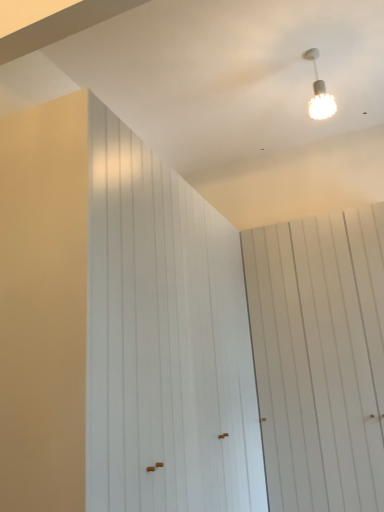
Find the location of a particular element. This screenshot has width=384, height=512. white wood barn door at left, the first barn door viewed from the left is located at coordinates (164, 340).

At what (x,y) coordinates should I click in order to perform the action: click on white textured lampshade at upper right. Please return your answer as a coordinate pair (x, y). Looking at the image, I should click on (319, 92).

Find the location of `white wood barn door at upper right, the 2th barn door positioned from the left`. white wood barn door at upper right, the 2th barn door positioned from the left is located at coordinates (320, 358).

Measure the distance between point (252, 268) and camera.

The distance of point (252, 268) from camera is 3.04 meters.

What are the coordinates of `white wood barn door at left, the first barn door viewed from the left` in the screenshot? It's located at (164, 340).

Is white wood barn door at upper right, the 1th barn door when ordered from right to left, surrounded by white textured lampshade at upper right?

No.

Can you confirm if white textured lampshade at upper right is taller than white wood barn door at upper right, the 2th barn door positioned from the left?

No, white textured lampshade at upper right is not taller than white wood barn door at upper right, the 2th barn door positioned from the left.

Considering the sizes of white textured lampshade at upper right and white wood barn door at upper right, the 1th barn door when ordered from right to left, in the image, is white textured lampshade at upper right wider or thinner than white wood barn door at upper right, the 1th barn door when ordered from right to left,?

Considering their sizes, white textured lampshade at upper right looks slimmer than white wood barn door at upper right, the 1th barn door when ordered from right to left.

Which of these two, white textured lampshade at upper right or white wood barn door at upper right, the 1th barn door when ordered from right to left, is smaller?

Smaller between the two is white textured lampshade at upper right.

Is white textured lampshade at upper right in contact with white wood barn door at left, positioned as the 2th barn door in right-to-left order?

No, white textured lampshade at upper right is not touching white wood barn door at left, positioned as the 2th barn door in right-to-left order.

In the image, is white textured lampshade at upper right positioned in front of or behind white wood barn door at left, the first barn door viewed from the left?

white textured lampshade at upper right is positioned farther from the viewer than white wood barn door at left, the first barn door viewed from the left.

Based on their sizes in the image, would you say white textured lampshade at upper right is bigger or smaller than white wood barn door at left, the first barn door viewed from the left?

Considering their sizes, white textured lampshade at upper right takes up less space than white wood barn door at left, the first barn door viewed from the left.

From the image's perspective, is white textured lampshade at upper right positioned above or below white wood barn door at left, positioned as the 2th barn door in right-to-left order?

white textured lampshade at upper right is above white wood barn door at left, positioned as the 2th barn door in right-to-left order.

How much distance is there between white wood barn door at left, the first barn door viewed from the left, and white wood barn door at upper right, the 2th barn door positioned from the left?

A distance of 30.41 inches exists between white wood barn door at left, the first barn door viewed from the left, and white wood barn door at upper right, the 2th barn door positioned from the left.

In order to click on barn door that is above the white wood barn door at upper right, the 1th barn door when ordered from right to left (from the image's perspective) in this screenshot , I will do `click(164, 340)`.

Considering the points (150, 453) and (258, 310), which point is behind, point (150, 453) or point (258, 310)?

The point (258, 310) is farther.

Which object is closer to the camera taking this photo, white wood barn door at left, positioned as the 2th barn door in right-to-left order, or white wood barn door at upper right, the 2th barn door positioned from the left?

white wood barn door at left, positioned as the 2th barn door in right-to-left order, is more forward.

Does white wood barn door at upper right, the 2th barn door positioned from the left, contain white textured lampshade at upper right?

No, white textured lampshade at upper right is not surrounded by white wood barn door at upper right, the 2th barn door positioned from the left.

In the image, is white wood barn door at upper right, the 1th barn door when ordered from right to left, on the left side or the right side of white textured lampshade at upper right?

white wood barn door at upper right, the 1th barn door when ordered from right to left, is positioned on white textured lampshade at upper right's right side.

Considering the sizes of objects white wood barn door at upper right, the 2th barn door positioned from the left, and white textured lampshade at upper right in the image provided, who is shorter, white wood barn door at upper right, the 2th barn door positioned from the left, or white textured lampshade at upper right?

With less height is white textured lampshade at upper right.

Between white wood barn door at upper right, the 2th barn door positioned from the left, and white textured lampshade at upper right, which one has smaller size?

white textured lampshade at upper right is smaller.

Can you confirm if white wood barn door at left, the first barn door viewed from the left, is thinner than white textured lampshade at upper right?

No.

From the image's perspective, would you say white wood barn door at left, positioned as the 2th barn door in right-to-left order, is positioned over white textured lampshade at upper right?

No, from the image's perspective, white wood barn door at left, positioned as the 2th barn door in right-to-left order, is not above white textured lampshade at upper right.

Is white wood barn door at left, positioned as the 2th barn door in right-to-left order, facing towards white textured lampshade at upper right?

No, white wood barn door at left, positioned as the 2th barn door in right-to-left order, is not turned towards white textured lampshade at upper right.

From a real-world perspective, which is physically below, white wood barn door at left, positioned as the 2th barn door in right-to-left order, or white textured lampshade at upper right?

white wood barn door at left, positioned as the 2th barn door in right-to-left order, is physically lower.

Between white wood barn door at upper right, the 2th barn door positioned from the left, and white wood barn door at left, positioned as the 2th barn door in right-to-left order, which one has smaller size?

With smaller size is white wood barn door at upper right, the 2th barn door positioned from the left.

Which object is positioned more to the right, white wood barn door at upper right, the 2th barn door positioned from the left, or white wood barn door at left, positioned as the 2th barn door in right-to-left order?

Positioned to the right is white wood barn door at upper right, the 2th barn door positioned from the left.

From a real-world perspective, which object stands above the other?

From a 3D spatial view, white wood barn door at upper right, the 1th barn door when ordered from right to left, is above.

Where is `barn door that is on the right side of white textured lampshade at upper right`? This screenshot has width=384, height=512. barn door that is on the right side of white textured lampshade at upper right is located at coordinates (320, 358).

This screenshot has height=512, width=384. I want to click on barn door that is the 1st object located below the white textured lampshade at upper right (from the image's perspective), so click(x=164, y=340).

Looking at the image, which one is located further to white wood barn door at left, positioned as the 2th barn door in right-to-left order, white wood barn door at upper right, the 1th barn door when ordered from right to left, or white textured lampshade at upper right?

Among the two, white textured lampshade at upper right is located further to white wood barn door at left, positioned as the 2th barn door in right-to-left order.

From the image, which object appears to be nearer to white wood barn door at upper right, the 2th barn door positioned from the left, white wood barn door at left, positioned as the 2th barn door in right-to-left order, or white textured lampshade at upper right?

white wood barn door at left, positioned as the 2th barn door in right-to-left order, lies closer to white wood barn door at upper right, the 2th barn door positioned from the left, than the other object.

Estimate the real-world distances between objects in this image. Which object is closer to white wood barn door at left, the first barn door viewed from the left, white textured lampshade at upper right or white wood barn door at upper right, the 1th barn door when ordered from right to left?

The object closer to white wood barn door at left, the first barn door viewed from the left, is white wood barn door at upper right, the 1th barn door when ordered from right to left.

Estimate the real-world distances between objects in this image. Which object is further from white textured lampshade at upper right, white wood barn door at left, the first barn door viewed from the left, or white wood barn door at upper right, the 1th barn door when ordered from right to left?

Based on the image, white wood barn door at left, the first barn door viewed from the left, appears to be further to white textured lampshade at upper right.

Looking at this image, based on their spatial positions, is white textured lampshade at upper right or white wood barn door at left, positioned as the 2th barn door in right-to-left order, closer to white wood barn door at upper right, the 2th barn door positioned from the left?

white wood barn door at left, positioned as the 2th barn door in right-to-left order.

When comparing their distances from white textured lampshade at upper right, does white wood barn door at upper right, the 2th barn door positioned from the left, or white wood barn door at left, the first barn door viewed from the left, seem closer?

Based on the image, white wood barn door at upper right, the 2th barn door positioned from the left, appears to be nearer to white textured lampshade at upper right.

You are a GUI agent. You are given a task and a screenshot of the screen. Output one action in this format:
    pyautogui.click(x=<x>, y=<y>)
    Task: Click on the barn door between white textured lampshade at upper right and white wood barn door at upper right, the 2th barn door positioned from the left, vertically
    
    Given the screenshot: What is the action you would take?
    pyautogui.click(x=164, y=340)